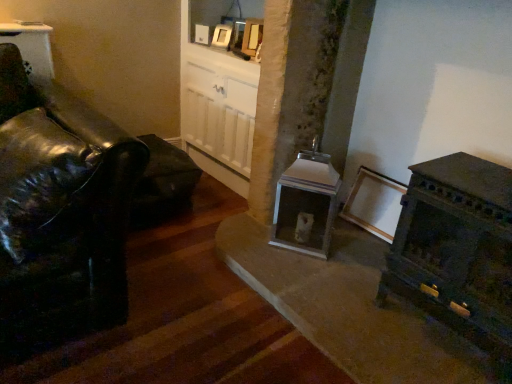
Question: From the image's perspective, is white glossy picture frame at upper center located beneath metallic silver fireplace at center?

Choices:
 (A) yes
 (B) no

Answer: (B)

Question: Is white glossy picture frame at upper center shorter than metallic silver fireplace at center?

Choices:
 (A) yes
 (B) no

Answer: (A)

Question: Is white glossy picture frame at upper center not close to metallic silver fireplace at center?

Choices:
 (A) yes
 (B) no

Answer: (A)

Question: Is metallic silver fireplace at center at the back of white glossy picture frame at upper center?

Choices:
 (A) yes
 (B) no

Answer: (B)

Question: Is white glossy picture frame at upper center bigger than metallic silver fireplace at center?

Choices:
 (A) no
 (B) yes

Answer: (A)

Question: Does white glossy picture frame at upper center have a smaller size compared to metallic silver fireplace at center?

Choices:
 (A) yes
 (B) no

Answer: (A)

Question: Can white glossy picture frame at upper center be found inside metallic silver fireplace at center?

Choices:
 (A) no
 (B) yes

Answer: (A)

Question: From the image's perspective, would you say metallic silver fireplace at center is shown under white glossy picture frame at upper center?

Choices:
 (A) yes
 (B) no

Answer: (A)

Question: Is metallic silver fireplace at center positioned before white glossy picture frame at upper center?

Choices:
 (A) no
 (B) yes

Answer: (B)

Question: Does metallic silver fireplace at center have a lesser width compared to white glossy picture frame at upper center?

Choices:
 (A) no
 (B) yes

Answer: (A)

Question: Can you confirm if metallic silver fireplace at center is bigger than white glossy picture frame at upper center?

Choices:
 (A) no
 (B) yes

Answer: (B)

Question: Does metallic silver fireplace at center turn towards white glossy picture frame at upper center?

Choices:
 (A) no
 (B) yes

Answer: (A)

Question: Considering the positions of point (214, 36) and point (338, 177), is point (214, 36) closer or farther from the camera than point (338, 177)?

Choices:
 (A) farther
 (B) closer

Answer: (A)